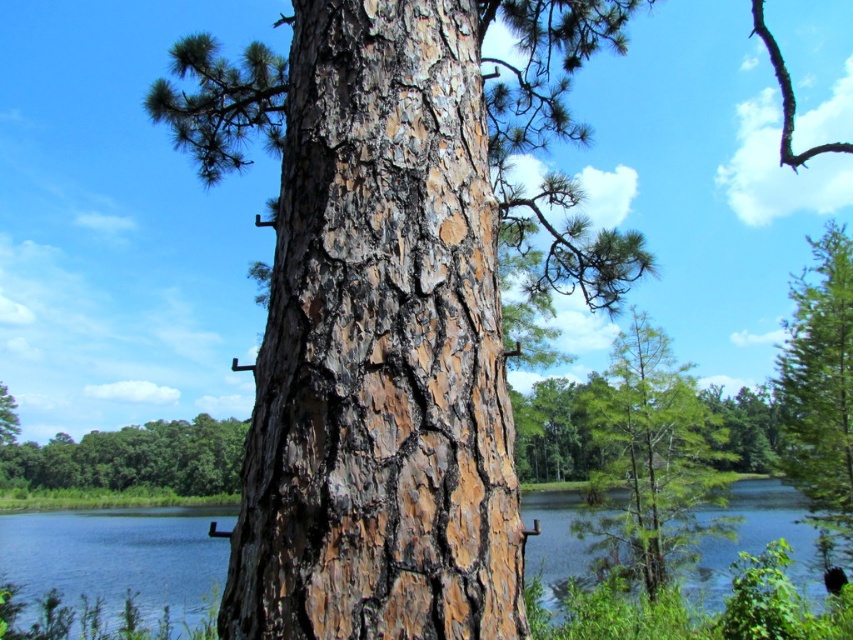
You are standing in front of the green rough bark tree at lower left and want to reach the blue water at center. Which direction should you walk to get there?

The blue water at center is to the right of the green rough bark tree at lower left, so you should walk to the right to reach the blue water at center.